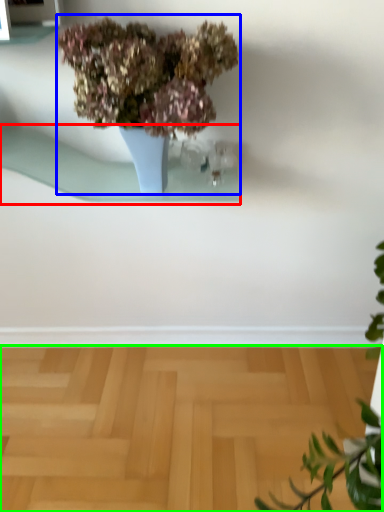
Question: Based on their relative distances, which object is farther from window sill (highlighted by a red box)? Choose from houseplant (highlighted by a blue box) and surface (highlighted by a green box).

Choices:
 (A) houseplant
 (B) surface

Answer: (B)